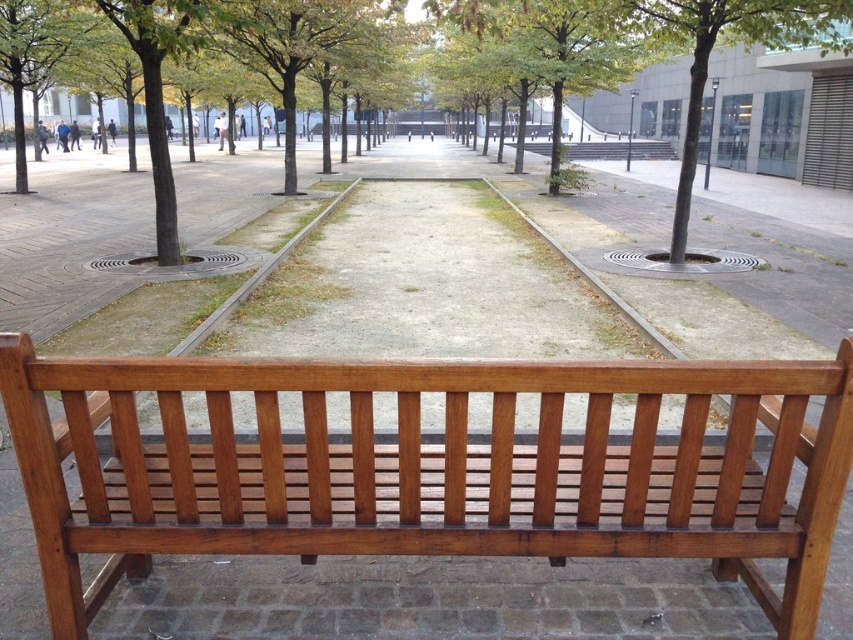
Question: Which point is farther to the camera?

Choices:
 (A) green leafy tree at upper right
 (B) shiny brown wood bench at center

Answer: (A)

Question: Which point appears closest to the camera in this image?

Choices:
 (A) (x=817, y=22)
 (B) (x=231, y=390)

Answer: (B)

Question: From the image, what is the correct spatial relationship of shiny brown wood bench at center in relation to green leafy tree at upper right?

Choices:
 (A) below
 (B) above

Answer: (A)

Question: Can you confirm if shiny brown wood bench at center is positioned to the right of green leafy tree at upper right?

Choices:
 (A) no
 (B) yes

Answer: (A)

Question: Which point is closer to the camera?

Choices:
 (A) shiny brown wood bench at center
 (B) green leafy tree at upper right

Answer: (A)

Question: Is shiny brown wood bench at center thinner than green leafy tree at upper right?

Choices:
 (A) no
 (B) yes

Answer: (B)